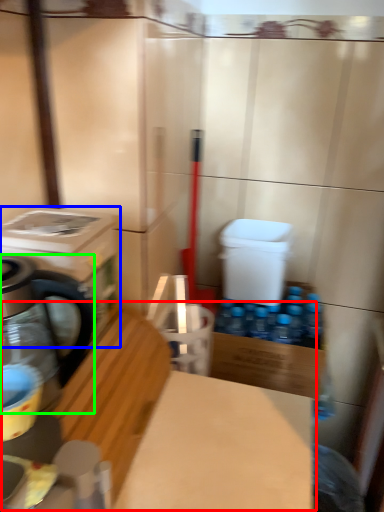
Question: Which object is positioned farthest from workbench (highlighted by a red box)? Select from washing machine (highlighted by a blue box) and kitchen appliance (highlighted by a green box).

Choices:
 (A) washing machine
 (B) kitchen appliance

Answer: (A)